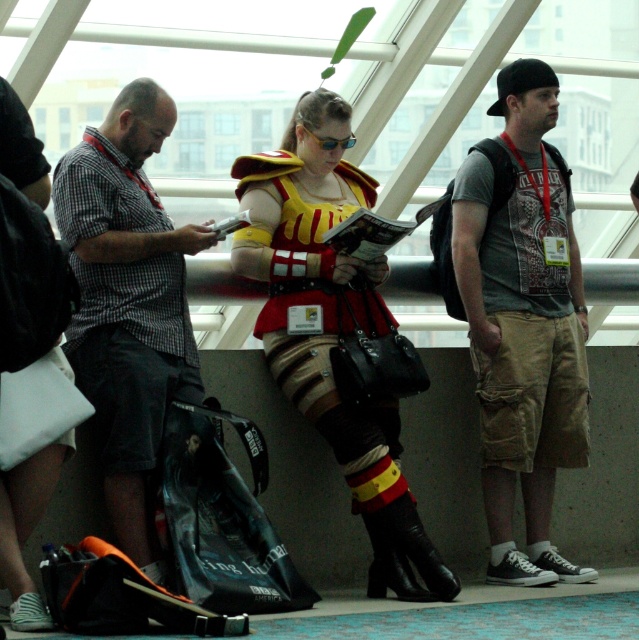
Does khaki cargo shorts at right appear on the left side of checkered fabric shirt at left?

In fact, khaki cargo shorts at right is to the right of checkered fabric shirt at left.

Locate an element on the screen. khaki cargo shorts at right is located at coordinates (523, 324).

I want to click on khaki cargo shorts at right, so click(x=523, y=324).

Image resolution: width=639 pixels, height=640 pixels. I want to click on khaki cargo shorts at right, so click(523, 324).

Looking at this image, does khaki cargo shorts at right appear under matte red armor at center?

Incorrect, khaki cargo shorts at right is not positioned below matte red armor at center.

Does point (525, 364) come in front of point (335, 292)?

No.

Locate an element on the screen. The width and height of the screenshot is (639, 640). khaki cargo shorts at right is located at coordinates (523, 324).

Between matte red armor at center and checkered fabric shirt at left, which one has more height?

matte red armor at center is taller.

Does matte red armor at center have a greater width compared to checkered fabric shirt at left?

Yes.

Locate an element on the screen. matte red armor at center is located at coordinates (332, 326).

The width and height of the screenshot is (639, 640). Identify the location of matte red armor at center. (332, 326).